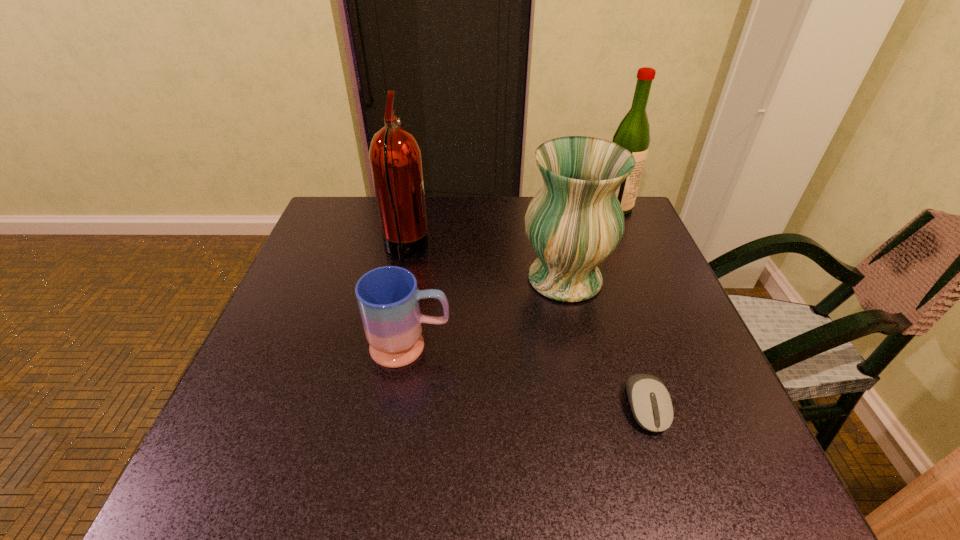
Locate an element on the screen. liquor is located at coordinates (633, 133).

This screenshot has width=960, height=540. I want to click on the farthest object, so click(633, 133).

This screenshot has width=960, height=540. I want to click on fire extinguisher, so click(x=395, y=157).

Where is `vase`? This screenshot has width=960, height=540. vase is located at coordinates (575, 221).

Locate an element on the screen. the second shortest object is located at coordinates (388, 297).

Find the location of a particular element. The image size is (960, 540). the second nearest object is located at coordinates [388, 297].

The height and width of the screenshot is (540, 960). I want to click on computer equipment, so click(650, 401).

This screenshot has width=960, height=540. I want to click on the nearest object, so click(650, 401).

Find the location of a particular element. Image resolution: width=960 pixels, height=540 pixels. free space located 0.320m on the label of the rightmost object is located at coordinates (491, 207).

What are the coordinates of `free space located 0.090m on the label of the rightmost object` in the screenshot? It's located at (568, 207).